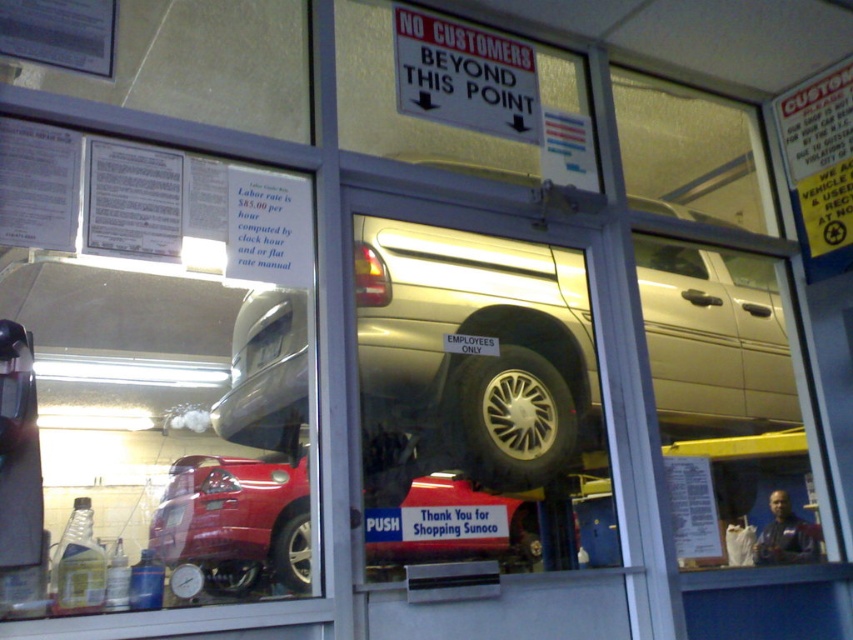
Question: Which point is farther to the camera?

Choices:
 (A) black rubber tire at center
 (B) silver metallic truck at center
 (C) black rubber tire at lower center
 (D) black rubber tire at lower left

Answer: (A)

Question: Is shiny red car at center positioned at the back of black rubber tire at center?

Choices:
 (A) yes
 (B) no

Answer: (B)

Question: Does black rubber tire at center lie in front of black rubber tire at lower left?

Choices:
 (A) yes
 (B) no

Answer: (B)

Question: Which object appears closest to the camera in this image?

Choices:
 (A) silver metallic truck at center
 (B) black rubber tire at lower left
 (C) black rubber tire at lower center

Answer: (C)

Question: Which is farther from the black rubber tire at lower center?

Choices:
 (A) black rubber tire at lower left
 (B) black rubber tire at center

Answer: (B)

Question: Does shiny red car at center appear under black rubber tire at lower center?

Choices:
 (A) yes
 (B) no

Answer: (B)